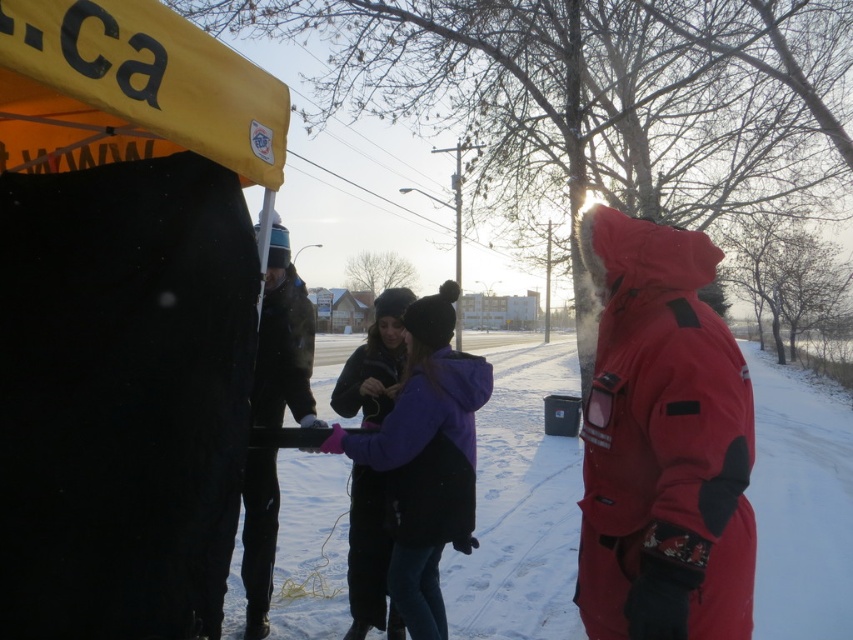
Does white fluffy snow at center come in front of red synthetic ski jacket at right?

No, it is not.

Image resolution: width=853 pixels, height=640 pixels. In order to click on white fluffy snow at center in this screenshot , I will do `click(520, 508)`.

Describe the element at coordinates (520, 508) in the screenshot. The image size is (853, 640). I see `white fluffy snow at center` at that location.

The image size is (853, 640). In order to click on white fluffy snow at center in this screenshot , I will do `click(520, 508)`.

Is white fluffy snow at center thinner than dark green fabric jacket at center?

In fact, white fluffy snow at center might be wider than dark green fabric jacket at center.

Which is more to the right, white fluffy snow at center or dark green fabric jacket at center?

From the viewer's perspective, white fluffy snow at center appears more on the right side.

The image size is (853, 640). What do you see at coordinates (520, 508) in the screenshot?
I see `white fluffy snow at center` at bounding box center [520, 508].

You are a GUI agent. You are given a task and a screenshot of the screen. Output one action in this format:
    pyautogui.click(x=<x>, y=<y>)
    Task: Click on the white fluffy snow at center
    This screenshot has width=853, height=640.
    Given the screenshot: What is the action you would take?
    pyautogui.click(x=520, y=508)

Between point (741, 458) and point (459, 273), which one is positioned in front?

Point (741, 458) is more forward.

Based on the photo, who is taller, red synthetic ski jacket at right or metallic pole at center?

With more height is metallic pole at center.

The image size is (853, 640). In order to click on red synthetic ski jacket at right in this screenshot , I will do `click(663, 440)`.